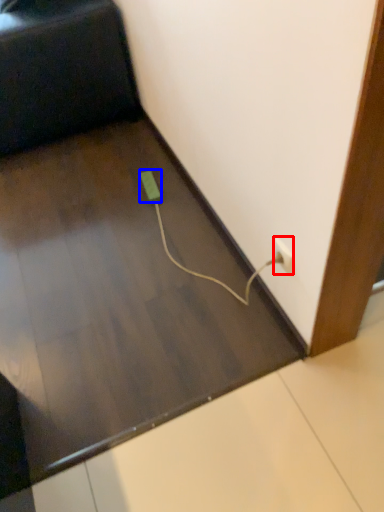
Question: Which point is closer to the camera, power plugs and sockets (highlighted by a red box) or socket (highlighted by a blue box)?

Choices:
 (A) power plugs and sockets
 (B) socket

Answer: (A)